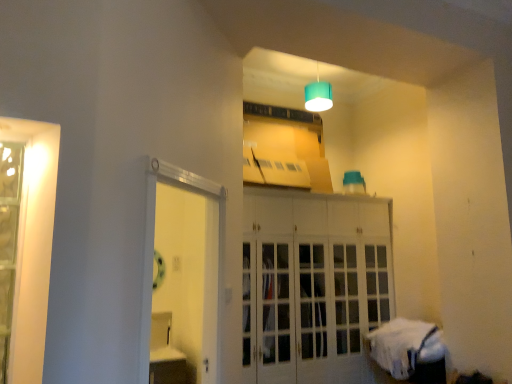
Question: Does white glossy door at center appear on the right side of teal fabric lampshade at upper center?

Choices:
 (A) no
 (B) yes

Answer: (A)

Question: Are white glossy door at center and teal fabric lampshade at upper center located far from each other?

Choices:
 (A) yes
 (B) no

Answer: (A)

Question: Considering the relative sizes of white glossy door at center and teal fabric lampshade at upper center in the image provided, is white glossy door at center smaller than teal fabric lampshade at upper center?

Choices:
 (A) yes
 (B) no

Answer: (B)

Question: From the image's perspective, is white glossy door at center under teal fabric lampshade at upper center?

Choices:
 (A) no
 (B) yes

Answer: (B)

Question: Considering the relative positions of white glossy door at center and teal fabric lampshade at upper center in the image provided, is white glossy door at center to the left of teal fabric lampshade at upper center from the viewer's perspective?

Choices:
 (A) yes
 (B) no

Answer: (A)

Question: From the image's perspective, is white glossy door at center above teal fabric lampshade at upper center?

Choices:
 (A) no
 (B) yes

Answer: (A)

Question: Is white fabric bed at lower right to the left of clear glass door at left from the viewer's perspective?

Choices:
 (A) no
 (B) yes

Answer: (A)

Question: Is white fabric bed at lower right to the right of clear glass door at left from the viewer's perspective?

Choices:
 (A) no
 (B) yes

Answer: (B)

Question: Considering the relative sizes of white fabric bed at lower right and clear glass door at left in the image provided, is white fabric bed at lower right thinner than clear glass door at left?

Choices:
 (A) yes
 (B) no

Answer: (B)

Question: Is white fabric bed at lower right wider than clear glass door at left?

Choices:
 (A) no
 (B) yes

Answer: (B)

Question: Does white fabric bed at lower right turn towards clear glass door at left?

Choices:
 (A) yes
 (B) no

Answer: (A)

Question: Does white fabric bed at lower right have a greater height compared to clear glass door at left?

Choices:
 (A) yes
 (B) no

Answer: (B)

Question: Is white glass cabinet at center facing away from clear glass door at left?

Choices:
 (A) no
 (B) yes

Answer: (A)